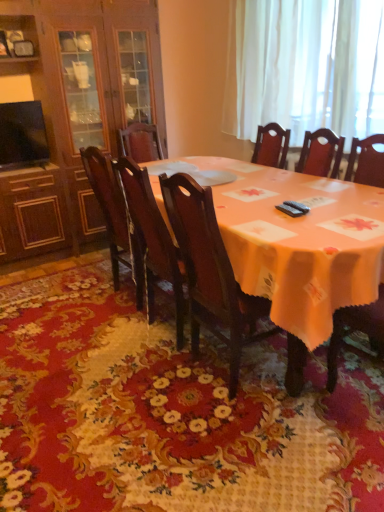
This screenshot has height=512, width=384. Identify the location of free point in front of dark wood chair at center, which is counted as the first chair, starting from the right. (259, 445).